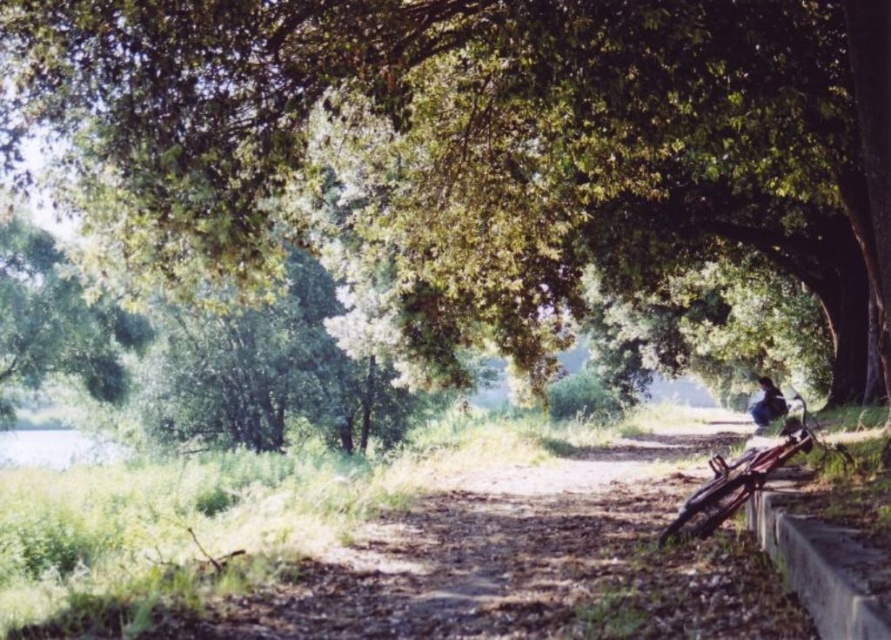
Question: Among these points, which one is farthest from the camera?

Choices:
 (A) (7, 64)
 (B) (761, 413)

Answer: (B)

Question: Can you confirm if green leafy tree at center is smaller than dark blue fabric at lower right?

Choices:
 (A) no
 (B) yes

Answer: (B)

Question: Can you confirm if green leafy tree at center is wider than dark blue fabric at lower right?

Choices:
 (A) no
 (B) yes

Answer: (B)

Question: Which point is farther to the camera?

Choices:
 (A) dark blue fabric at lower right
 (B) green leafy tree at center

Answer: (A)

Question: Which object appears closest to the camera in this image?

Choices:
 (A) green leafy tree at center
 (B) dark blue fabric at lower right

Answer: (A)

Question: Can you confirm if green leafy tree at center is positioned to the left of dark blue fabric at lower right?

Choices:
 (A) yes
 (B) no

Answer: (A)